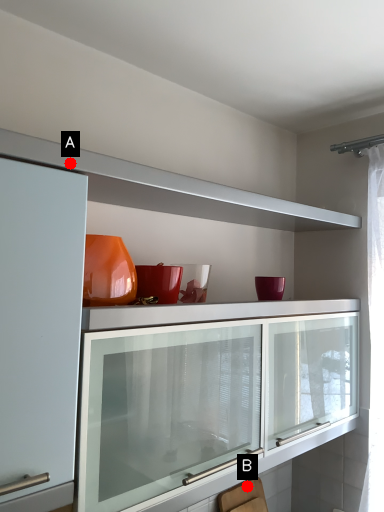
Question: Two points are circled on the image, labeled by A and B beside each circle. Which of the following is the closest to the observer?

Choices:
 (A) A is closer
 (B) B is closer

Answer: (A)